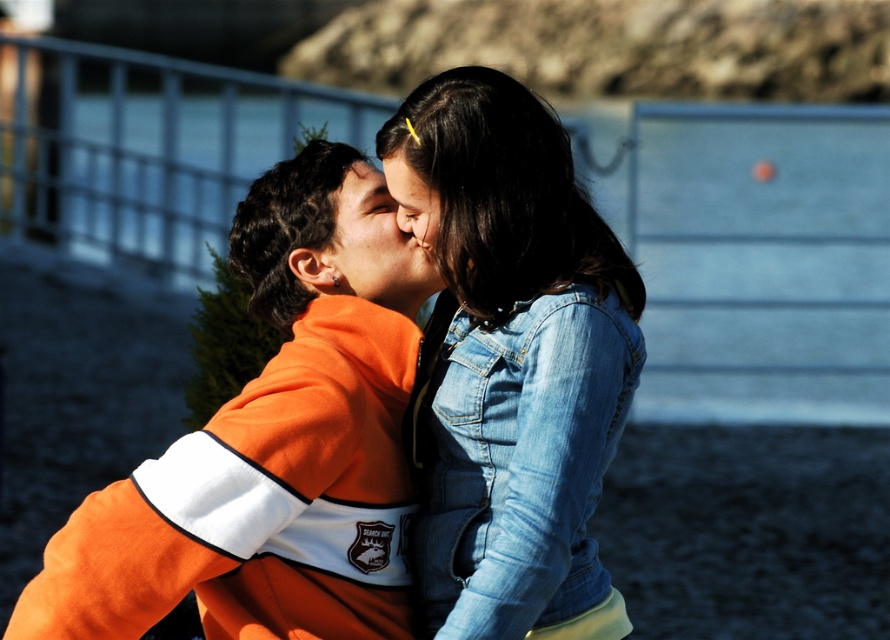
Is faded denim jacket at lower right wider than matte orange sweatshirt at center?

Correct, the width of faded denim jacket at lower right exceeds that of matte orange sweatshirt at center.

Who is lower down, faded denim jacket at lower right or matte orange sweatshirt at center?

faded denim jacket at lower right is below.

This screenshot has width=890, height=640. What are the coordinates of `faded denim jacket at lower right` in the screenshot? It's located at (514, 460).

Is faded denim jacket at lower right thinner than matte denim jacket at center?

No.

Does faded denim jacket at lower right appear under matte denim jacket at center?

Correct, faded denim jacket at lower right is located below matte denim jacket at center.

Find the location of a particular element. This screenshot has width=890, height=640. faded denim jacket at lower right is located at coordinates (514, 460).

Is denim jacket at upper center thinner than matte denim jacket at center?

Incorrect, denim jacket at upper center's width is not less than matte denim jacket at center's.

Consider the image. Is denim jacket at upper center positioned at the back of matte denim jacket at center?

No, it is in front of matte denim jacket at center.

Where is `denim jacket at upper center`? denim jacket at upper center is located at coordinates (273, 444).

Where is `denim jacket at upper center`? The width and height of the screenshot is (890, 640). denim jacket at upper center is located at coordinates (273, 444).